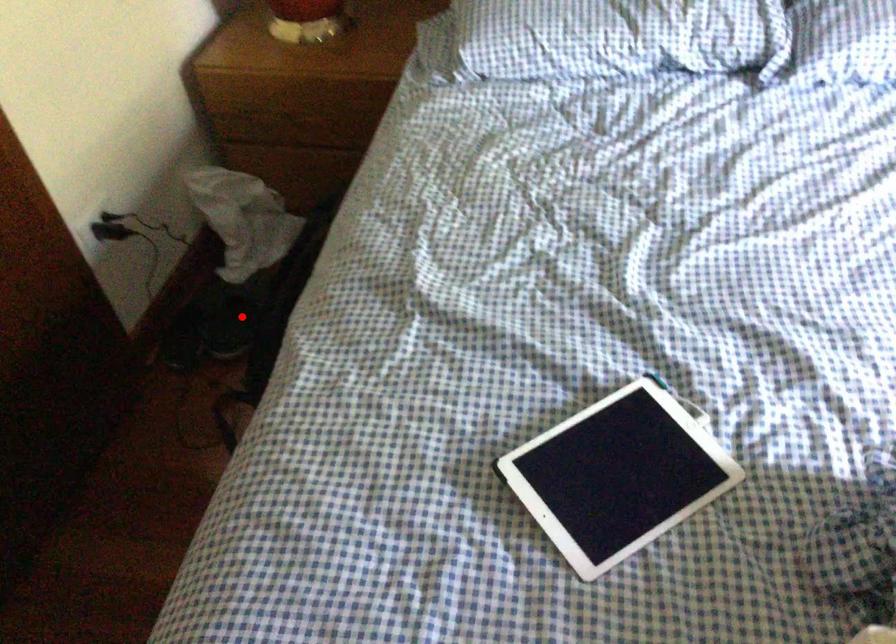
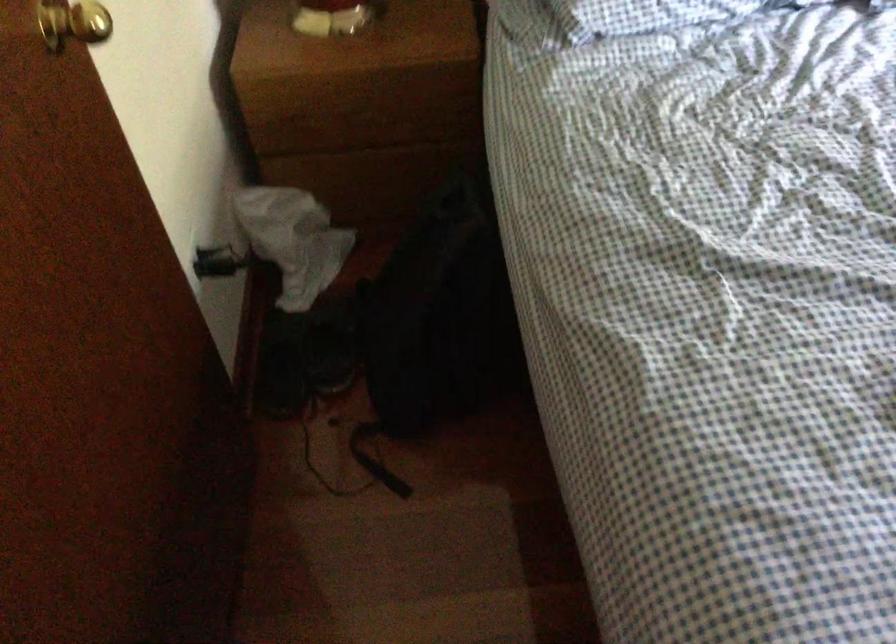
The point at the highlighted location is marked in the first image. Where is the corresponding point in the second image?

(332, 345)